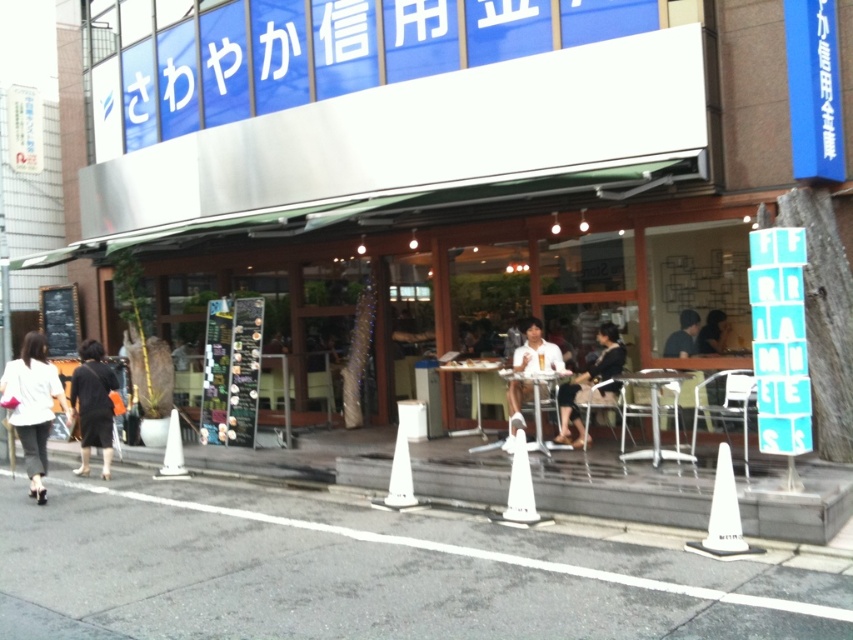
Can you confirm if metallic silver table at lower center is positioned to the left of white plastic traffic cone at lower left?

In fact, metallic silver table at lower center is to the right of white plastic traffic cone at lower left.

Describe the element at coordinates (653, 410) in the screenshot. I see `metallic silver table at lower center` at that location.

Does point (663, 454) lie in front of point (171, 477)?

That is True.

Find the location of `metallic silver table at lower center`. metallic silver table at lower center is located at coordinates (653, 410).

Is gray concrete pavement at lower center thinner than dark brown hair at upper right?

In fact, gray concrete pavement at lower center might be wider than dark brown hair at upper right.

Between point (563, 560) and point (721, 332), which one is positioned in front?

Point (563, 560) is more forward.

Is point (664, 624) closer to camera compared to point (723, 317)?

Yes, point (664, 624) is in front of point (723, 317).

Where is `gray concrete pavement at lower center`? The width and height of the screenshot is (853, 640). gray concrete pavement at lower center is located at coordinates (363, 572).

Is white matte shirt at center to the right of metallic silver table at lower center from the viewer's perspective?

No, white matte shirt at center is not to the right of metallic silver table at lower center.

From the picture: Between white matte shirt at center and metallic silver table at lower center, which one appears on the right side from the viewer's perspective?

From the viewer's perspective, metallic silver table at lower center appears more on the right side.

Is point (509, 394) positioned before point (653, 401)?

No, (509, 394) is further to viewer.

Locate an element on the screen. The width and height of the screenshot is (853, 640). white matte shirt at center is located at coordinates (537, 352).